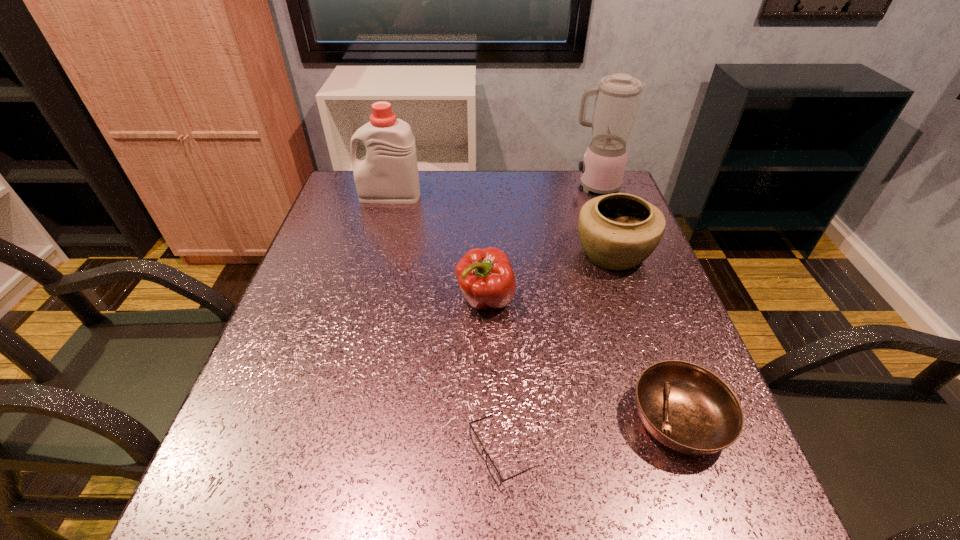
Locate an element on the screen. This screenshot has height=540, width=960. object that ranks as the second closest to the tallest object is located at coordinates (485, 276).

Where is `vacant region that satisfies the following two spatial constraints: 1. on the handle side of the pottery; 2. on the right side of the detergent`? vacant region that satisfies the following two spatial constraints: 1. on the handle side of the pottery; 2. on the right side of the detergent is located at coordinates (374, 254).

This screenshot has width=960, height=540. I want to click on vacant region that satisfies the following two spatial constraints: 1. on the base of the tallest object near the control knob; 2. on the front side of the pepper, so click(x=635, y=300).

Locate an element on the screen. Image resolution: width=960 pixels, height=540 pixels. vacant position in the image that satisfies the following two spatial constraints: 1. on the base of the food processor near the control knob; 2. on the left side of the soup bowl is located at coordinates (678, 420).

Image resolution: width=960 pixels, height=540 pixels. What are the coordinates of `vacant position in the image that satisfies the following two spatial constraints: 1. on the handle side of the leftmost object; 2. on the left side of the pepper` in the screenshot? It's located at (362, 300).